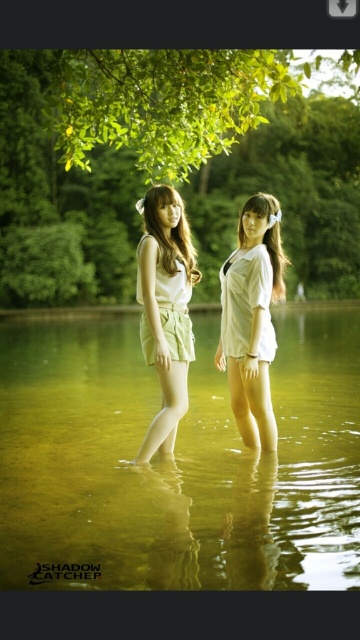
You are a photographer planning to capture a closeup of the white matte shirt at center and the light green cotton shorts at center. Given their sizes, which one should you focus on to ensure it fills the frame adequately without cropping?

The white matte shirt at center is larger in size than the light green cotton shorts at center, so focusing on the white matte shirt at center would ensure it fills the frame adequately without cropping.

You are planning to take a photo of the clear water at center and the light green cotton shorts at center. Which object would you focus on first if you want to capture both in the same frame, considering their sizes?

The clear water at center has a larger size compared to light green cotton shorts at center, so you should focus on the clear water at center first to ensure it is in sharp focus before adjusting for the smaller light green cotton shorts at center.